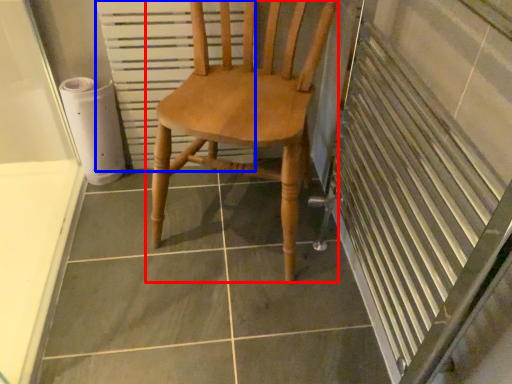
Question: Among these objects, which one is farthest to the camera, chair (highlighted by a red box) or radiator (highlighted by a blue box)?

Choices:
 (A) chair
 (B) radiator

Answer: (B)